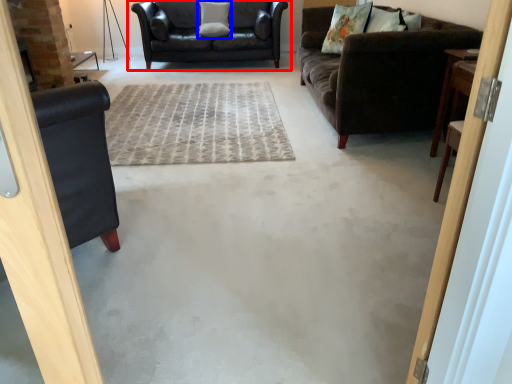
Question: Which object is closer to the camera taking this photo, studio couch (highlighted by a red box) or pillow (highlighted by a blue box)?

Choices:
 (A) studio couch
 (B) pillow

Answer: (A)